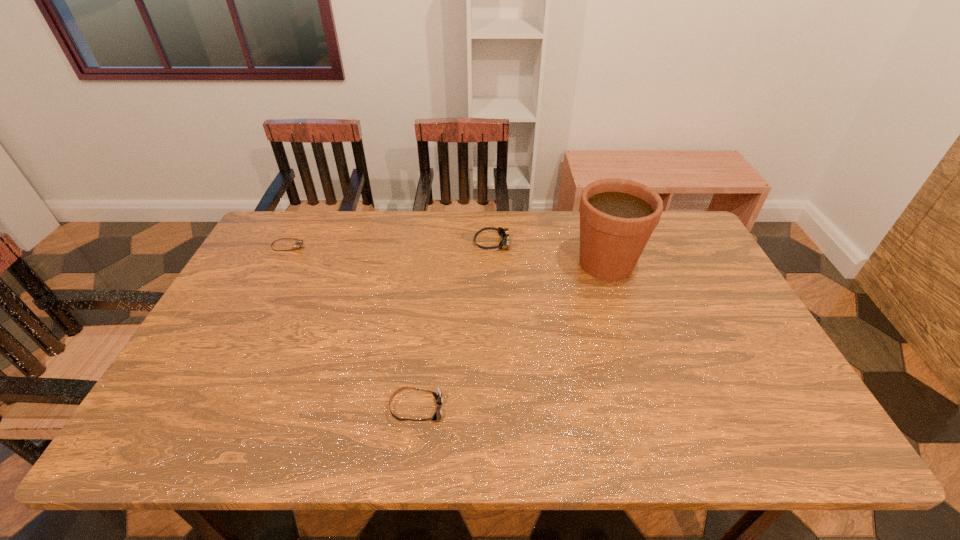
The image size is (960, 540). I want to click on blank space at the left edge of the desktop, so click(245, 370).

The width and height of the screenshot is (960, 540). Find the location of `vacant space at the far left corner`. vacant space at the far left corner is located at coordinates (271, 237).

Identify the location of vacant region between the flowerpot and the tallest goggles. (549, 253).

Locate an element on the screen. Image resolution: width=960 pixels, height=540 pixels. free space between the leftmost goggles and the second goggles from left to right is located at coordinates (353, 328).

Where is `free space that is in between the third shortest object and the flowerpot`? free space that is in between the third shortest object and the flowerpot is located at coordinates (549, 253).

I want to click on vacant area between the second tallest object and the tallest object, so click(x=549, y=253).

Where is `vacant space in between the flowerpot and the second object from right to left`? This screenshot has height=540, width=960. vacant space in between the flowerpot and the second object from right to left is located at coordinates pos(549,253).

At what (x,y) coordinates should I click in order to perform the action: click on free space between the flowerpot and the nearest goggles. Please return your answer as a coordinate pair (x, y). The height and width of the screenshot is (540, 960). Looking at the image, I should click on (512, 336).

At what (x,y) coordinates should I click in order to perform the action: click on vacant area that lies between the second object from left to right and the second object from right to left. Please return your answer as a coordinate pair (x, y). The height and width of the screenshot is (540, 960). Looking at the image, I should click on (455, 326).

What are the coordinates of `free spot between the flowerpot and the tallest goggles` in the screenshot? It's located at (549, 253).